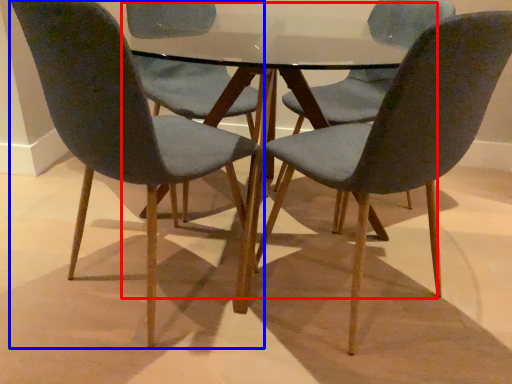
Question: Which of the following is the closest to the observer, round table (highlighted by a red box) or chair (highlighted by a blue box)?

Choices:
 (A) round table
 (B) chair

Answer: (B)